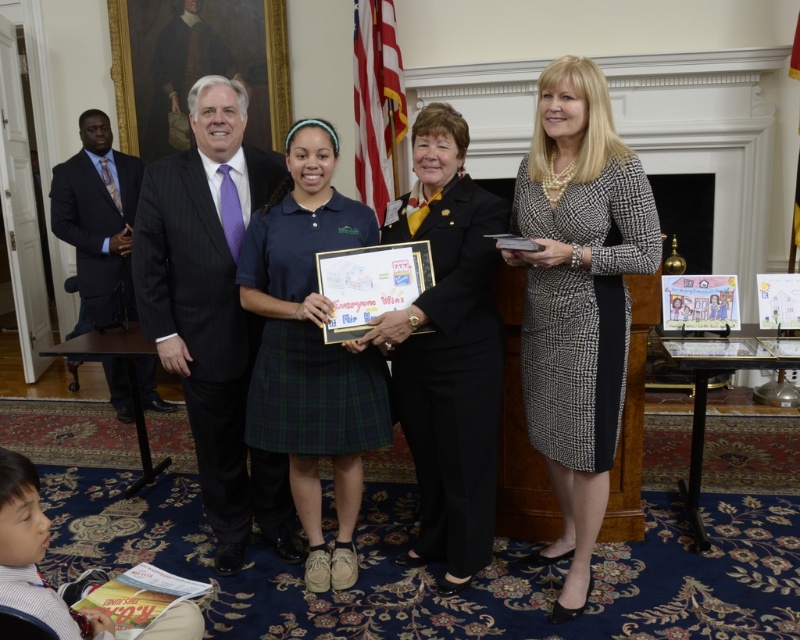
Question: Among these objects, which one is nearest to the camera?

Choices:
 (A) dark blue suit at left
 (B) matte blue uniform at center
 (C) black wool suit at center
 (D) dark gray pinstripe suit at center

Answer: (C)

Question: Which point is farther to the camera?

Choices:
 (A) (208, 513)
 (B) (425, 214)
 (C) (588, 410)

Answer: (A)

Question: Is black and white textured dress at center to the right of black wool suit at center from the viewer's perspective?

Choices:
 (A) yes
 (B) no

Answer: (A)

Question: Which is nearer to the black wool suit at center?

Choices:
 (A) dark gray pinstripe suit at center
 (B) dark blue suit at left
 (C) black and white textured dress at center
 (D) matte blue uniform at center

Answer: (C)

Question: Observing the image, what is the correct spatial positioning of black and white textured dress at center in reference to dark blue suit at left?

Choices:
 (A) below
 (B) above

Answer: (A)

Question: Can you confirm if black and white textured dress at center is smaller than matte blue uniform at center?

Choices:
 (A) no
 (B) yes

Answer: (A)